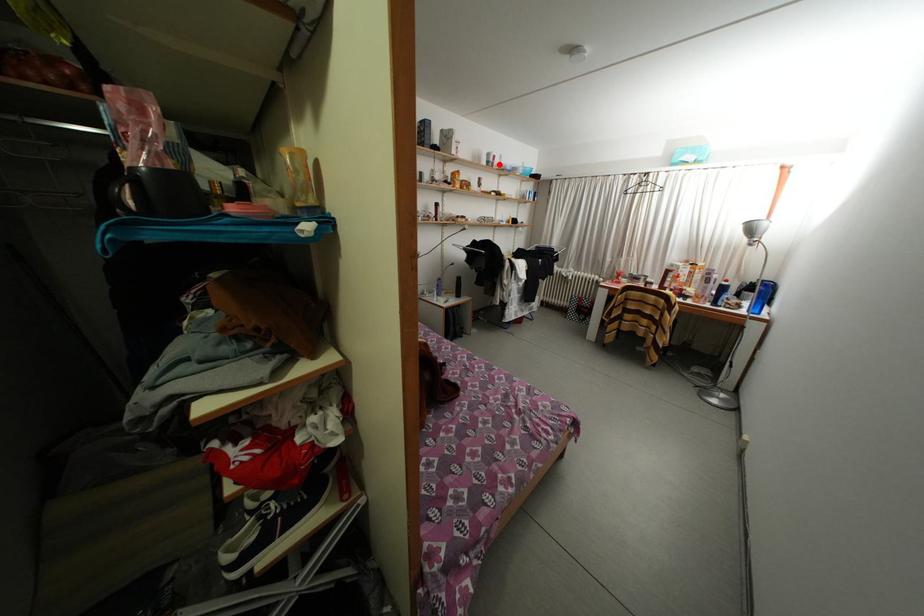
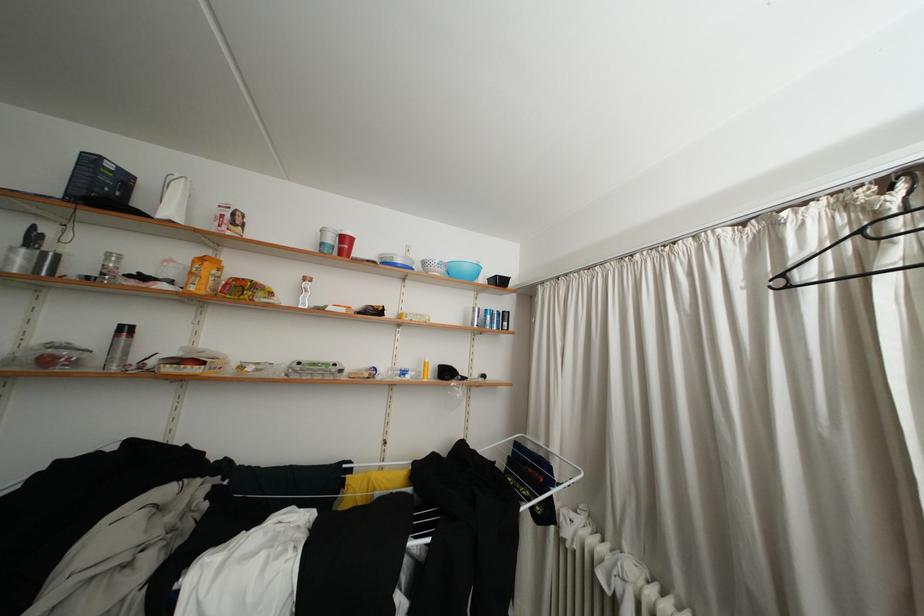
Where in the second image is the point corresponding to the highlighted location from the first image?

(338, 245)